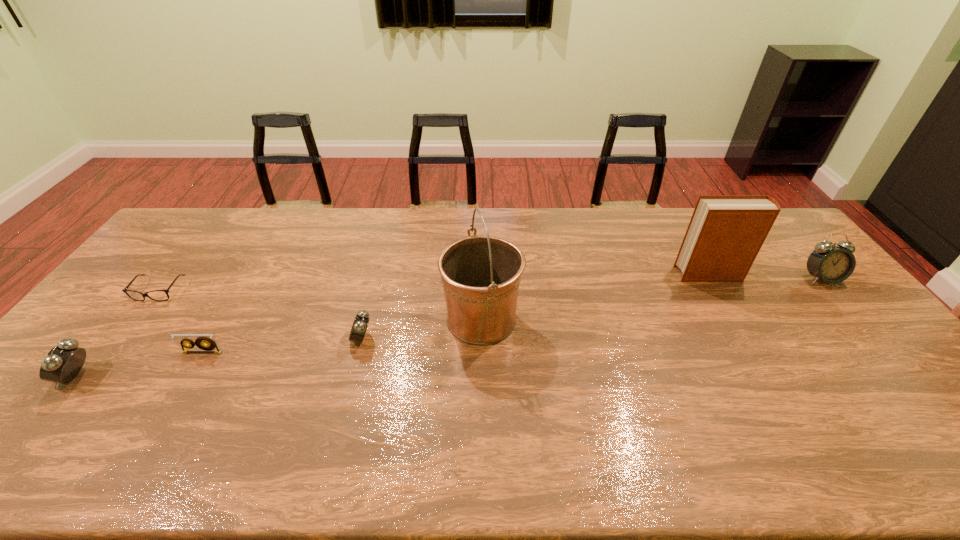
Where is `vacant point located between the tallest alarm clock and the tallest object`? vacant point located between the tallest alarm clock and the tallest object is located at coordinates (651, 299).

Find the location of a particular element. The image size is (960, 540). object that is the fifth closest to the sixth object from left to right is located at coordinates (125, 290).

Locate an element on the screen. Image resolution: width=960 pixels, height=540 pixels. the fifth closest object to the farthest alarm clock is located at coordinates (125, 290).

Locate which alarm clock ranks in proximity to the sixth shortest object. Please provide its 2D coordinates. Your answer should be formatted as a tuple, i.e. [(x, y)], where the tuple contains the x and y coordinates of a point satisfying the conditions above.

[(832, 264)]

Locate which alarm clock ranks second in proximity to the second alarm clock from right to left. Please provide its 2D coordinates. Your answer should be formatted as a tuple, i.e. [(x, y)], where the tuple contains the x and y coordinates of a point satisfying the conditions above.

[(832, 264)]

The width and height of the screenshot is (960, 540). I want to click on vacant space that satisfies the following two spatial constraints: 1. at the front of the sixth tallest object with visible reels; 2. on the face of the fourth tallest object, so click(x=188, y=376).

Where is `vacant space that satisfies the following two spatial constraints: 1. on the front-facing side of the spectacles; 2. on the face of the fourth shortest object`? The height and width of the screenshot is (540, 960). vacant space that satisfies the following two spatial constraints: 1. on the front-facing side of the spectacles; 2. on the face of the fourth shortest object is located at coordinates (92, 376).

Identify the location of free space that satisfies the following two spatial constraints: 1. on the front-facing side of the shortest object; 2. on the face of the leftmost alarm clock. The width and height of the screenshot is (960, 540). (92, 376).